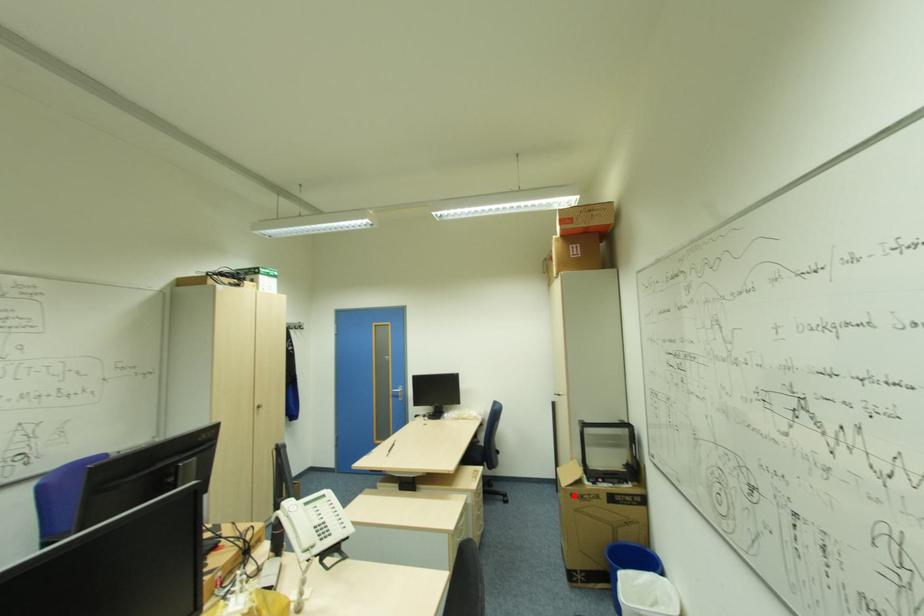
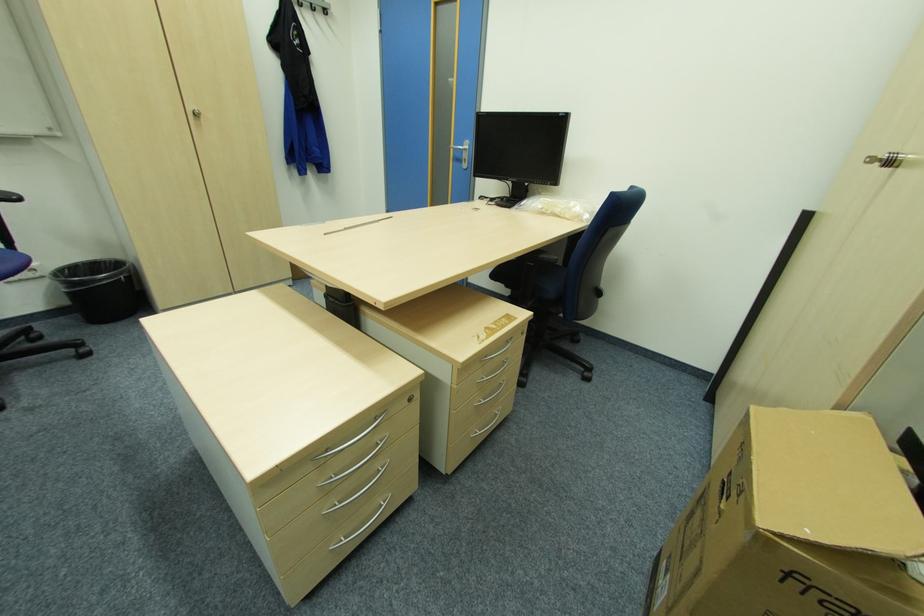
Question: A red point is marked in image1. In image2, is the corresponding 3D point closer to the camera or farther? Reply with the corresponding letter.

Choices:
 (A) The corresponding 3D point is closer.
 (B) The corresponding 3D point is farther.

Answer: (B)